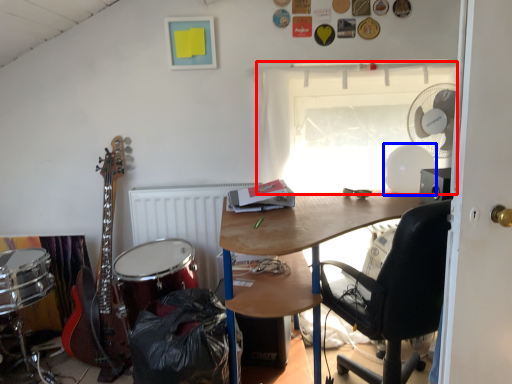
Question: Among these objects, which one is farthest to the camera, window (highlighted by a red box) or mechanical fan (highlighted by a blue box)?

Choices:
 (A) window
 (B) mechanical fan

Answer: (A)